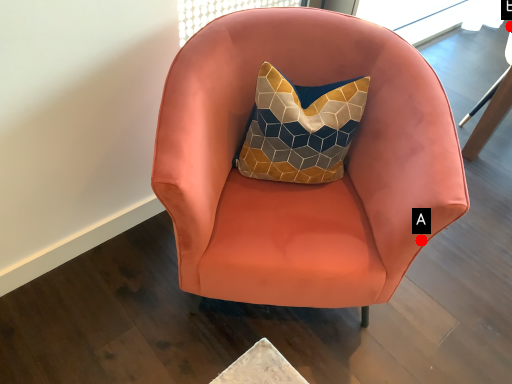
Question: Two points are circled on the image, labeled by A and B beside each circle. Among these points, which one is farthest from the camera?

Choices:
 (A) A is further
 (B) B is further

Answer: (B)